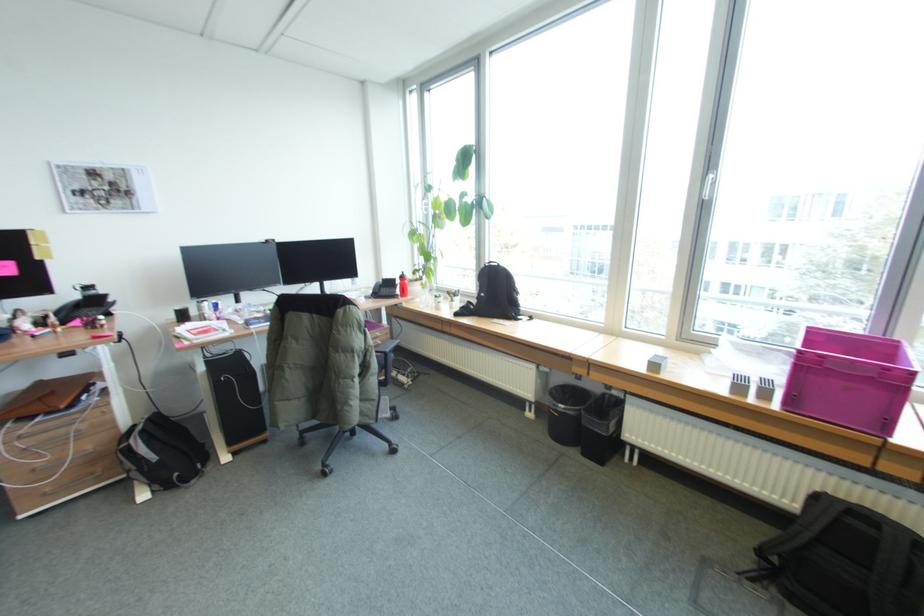
Where is `red and silver can`? Image resolution: width=924 pixels, height=616 pixels. red and silver can is located at coordinates (849, 379).